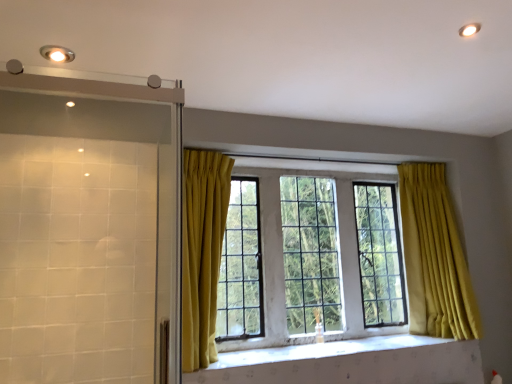
Question: Is clear glass window at center in front of or behind clear glass shower door at left in the image?

Choices:
 (A) front
 (B) behind

Answer: (B)

Question: From the image's perspective, is clear glass window at center positioned above or below clear glass shower door at left?

Choices:
 (A) below
 (B) above

Answer: (A)

Question: Considering the real-world distances, which object is farthest from the clear glass shower door at left?

Choices:
 (A) clear glass window at center
 (B) white textured stone at center
 (C) matte silver light fixture at upper left
 (D) white glossy light fixture at upper right

Answer: (A)

Question: Considering the real-world distances, which object is closest to the clear glass window at center?

Choices:
 (A) clear glass shower door at left
 (B) matte silver light fixture at upper left
 (C) white glossy light fixture at upper right
 (D) white textured stone at center

Answer: (D)